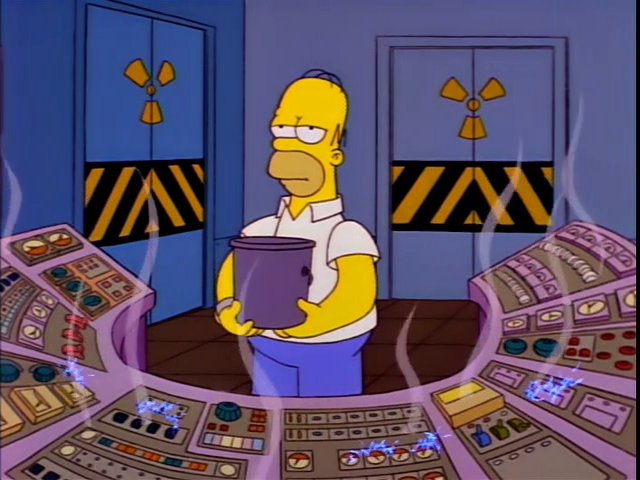
Find the location of `knobs`. knobs is located at coordinates (45, 376), (6, 370), (225, 412), (547, 351), (515, 346).